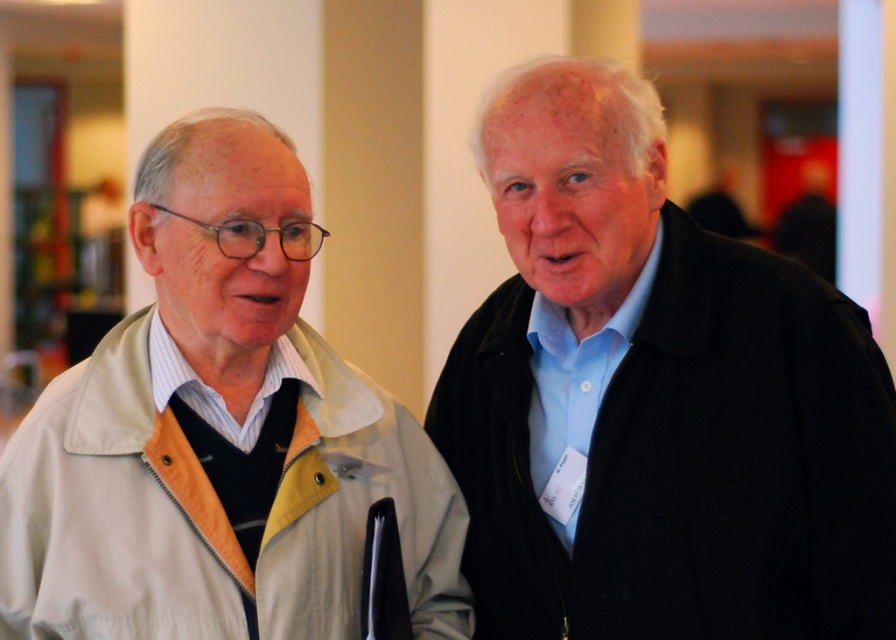
You are a photographer at an event and need to capture a photo of both the light beige jacket at left and the black woolen coat at right. Since you want to ensure both are fully visible, which jacket should you focus on to avoid cropping the taller one?

The light beige jacket at left is much taller than the black woolen coat at right, so you should focus on the light beige jacket at left to avoid cropping the taller one.

You are organizing a coat rack for an event and need to hang the light beige jacket at left and the black woolen coat at right. Which coat should you place on the narrower hanger to ensure they both fit properly?

The light beige jacket at left is thinner than the black woolen coat at right, so it should be placed on the narrower hanger to accommodate their respective thicknesses.